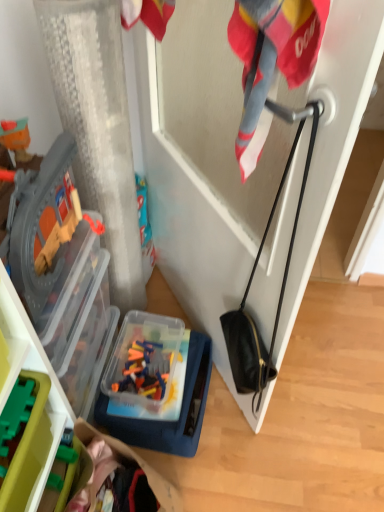
Locate an element on the screen. The height and width of the screenshot is (512, 384). translucent plastic container at lower center is located at coordinates (164, 422).

What do you see at coordinates (164, 422) in the screenshot? I see `translucent plastic container at lower center` at bounding box center [164, 422].

Locate an element on the screen. The image size is (384, 512). green plastic toy blocks at lower left is located at coordinates (16, 412).

The height and width of the screenshot is (512, 384). What do you see at coordinates (16, 412) in the screenshot?
I see `green plastic toy blocks at lower left` at bounding box center [16, 412].

At what (x,y) coordinates should I click in order to perform the action: click on translucent plastic container at lower center. Please return your answer as a coordinate pair (x, y). This screenshot has height=512, width=384. Looking at the image, I should click on 164,422.

Based on their positions, is green plastic toy blocks at lower left located to the left or right of translucent plastic container at lower center?

green plastic toy blocks at lower left is to the left of translucent plastic container at lower center.

Relative to translucent plastic container at lower center, is green plastic toy blocks at lower left in front or behind?

green plastic toy blocks at lower left is in front of translucent plastic container at lower center.

Which is closer, (14, 406) or (165, 429)?

Point (14, 406) is closer to the camera than point (165, 429).

From the image's perspective, is green plastic toy blocks at lower left above or below translucent plastic container at lower center?

Clearly, from the image's perspective, green plastic toy blocks at lower left is above translucent plastic container at lower center.

From a real-world perspective, is green plastic toy blocks at lower left physically located above or below translucent plastic container at lower center?

green plastic toy blocks at lower left is above translucent plastic container at lower center.

Consider the image. Considering the sizes of green plastic toy blocks at lower left and translucent plastic container at lower center in the image, is green plastic toy blocks at lower left wider or thinner than translucent plastic container at lower center?

Clearly, green plastic toy blocks at lower left has less width compared to translucent plastic container at lower center.

Between green plastic toy blocks at lower left and translucent plastic container at lower center, which one has more height?

Standing taller between the two is translucent plastic container at lower center.

Which of these two, green plastic toy blocks at lower left or translucent plastic container at lower center, is bigger?

With larger size is translucent plastic container at lower center.

Would you say green plastic toy blocks at lower left contains translucent plastic container at lower center?

No.

Are green plastic toy blocks at lower left and translucent plastic container at lower center making contact?

No, green plastic toy blocks at lower left is not with translucent plastic container at lower center.

In the scene shown: Is green plastic toy blocks at lower left oriented away from translucent plastic container at lower center?

No, green plastic toy blocks at lower left is not facing the opposite direction of translucent plastic container at lower center.

Measure the distance between green plastic toy blocks at lower left and translucent plastic container at lower center.

green plastic toy blocks at lower left is 23.33 inches away from translucent plastic container at lower center.

This screenshot has width=384, height=512. I want to click on box behind the green plastic toy blocks at lower left, so click(x=164, y=422).

Which is more to the left, translucent plastic container at lower center or green plastic toy blocks at lower left?

green plastic toy blocks at lower left.

Is translucent plastic container at lower center closer to the viewer compared to green plastic toy blocks at lower left?

No, it is not.

Is point (109, 432) closer to viewer compared to point (2, 426)?

No, it is behind (2, 426).

From the image's perspective, between translucent plastic container at lower center and green plastic toy blocks at lower left, which one is located above?

From the image's view, green plastic toy blocks at lower left is above.

From a real-world perspective, is translucent plastic container at lower center under green plastic toy blocks at lower left?

Indeed, from a real-world perspective, translucent plastic container at lower center is positioned beneath green plastic toy blocks at lower left.

Between translucent plastic container at lower center and green plastic toy blocks at lower left, which one has larger width?

Wider between the two is translucent plastic container at lower center.

Which of these two, translucent plastic container at lower center or green plastic toy blocks at lower left, stands shorter?

green plastic toy blocks at lower left is shorter.

Consider the image. In terms of size, does translucent plastic container at lower center appear bigger or smaller than green plastic toy blocks at lower left?

Considering their sizes, translucent plastic container at lower center takes up more space than green plastic toy blocks at lower left.

Is translucent plastic container at lower center completely or partially outside of green plastic toy blocks at lower left?

That's correct, translucent plastic container at lower center is outside of green plastic toy blocks at lower left.

Looking at this image, are translucent plastic container at lower center and green plastic toy blocks at lower left beside each other?

No.

Could you tell me if translucent plastic container at lower center is turned towards green plastic toy blocks at lower left?

No, translucent plastic container at lower center is not aimed at green plastic toy blocks at lower left.

How much distance is there between translucent plastic container at lower center and green plastic toy blocks at lower left?

59.25 centimeters.

This screenshot has height=512, width=384. Identify the location of toy on the left of translucent plastic container at lower center. (16, 412).

Identify the location of toy above the translucent plastic container at lower center (from the image's perspective). The width and height of the screenshot is (384, 512). (16, 412).

At what (x,y) coordinates should I click in order to perform the action: click on box located underneath the green plastic toy blocks at lower left (from a real-world perspective). Please return your answer as a coordinate pair (x, y). The image size is (384, 512). Looking at the image, I should click on (164, 422).